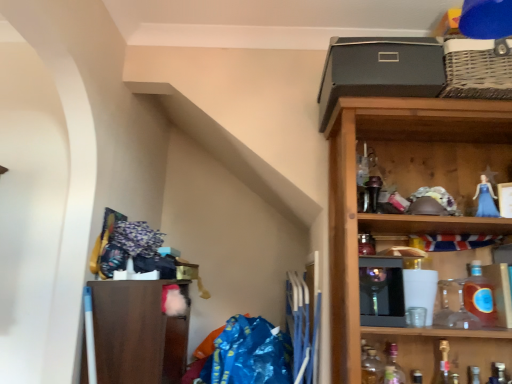
Question: Is translucent amber glass bottle at right, positioned as the 2th bottle in right-to-left order, shorter than translucent glass bottle at lower right, which is counted as the fifth bottle, starting from the right?

Choices:
 (A) no
 (B) yes

Answer: (B)

Question: From the image's perspective, does translucent amber glass bottle at right, positioned as the 2th bottle in right-to-left order, appear higher than translucent glass bottle at lower right, which appears as the 1th bottle when viewed from the left?

Choices:
 (A) yes
 (B) no

Answer: (A)

Question: Is the depth of translucent amber glass bottle at right, positioned as the 2th bottle in right-to-left order, less than that of translucent glass bottle at lower right, which is counted as the fifth bottle, starting from the right?

Choices:
 (A) no
 (B) yes

Answer: (A)

Question: Are translucent amber glass bottle at right, positioned as the 2th bottle in right-to-left order, and translucent glass bottle at lower right, which appears as the 1th bottle when viewed from the left, far apart?

Choices:
 (A) no
 (B) yes

Answer: (A)

Question: Is translucent glass bottle at lower right, which appears as the 1th bottle when viewed from the left, located within translucent amber glass bottle at right, positioned as the 2th bottle in right-to-left order?

Choices:
 (A) no
 (B) yes

Answer: (A)

Question: Is wooden shelf at upper right, which ranks as the second shelf in left-to-right order, wider or thinner than translucent glass bottle at lower right, the second bottle viewed from the left?

Choices:
 (A) wide
 (B) thin

Answer: (A)

Question: Relative to translucent glass bottle at lower right, arranged as the fourth bottle when viewed from the right, is wooden shelf at upper right, which ranks as the second shelf in left-to-right order, in front or behind?

Choices:
 (A) front
 (B) behind

Answer: (A)

Question: Visually, is wooden shelf at upper right, which is the 1th shelf from right to left, positioned to the left or to the right of translucent glass bottle at lower right, the second bottle viewed from the left?

Choices:
 (A) right
 (B) left

Answer: (A)

Question: Is wooden shelf at upper right, which ranks as the second shelf in left-to-right order, spatially inside translucent glass bottle at lower right, arranged as the fourth bottle when viewed from the right, or outside of it?

Choices:
 (A) outside
 (B) inside

Answer: (A)

Question: From a real-world perspective, is translucent amber glass bottle at right, the 4th bottle from the left, physically located above or below brown matte cabinet at lower left, positioned as the second shelf in right-to-left order?

Choices:
 (A) above
 (B) below

Answer: (A)

Question: Considering the relative positions of translucent amber glass bottle at right, the 4th bottle from the left, and brown matte cabinet at lower left, positioned as the second shelf in right-to-left order, in the image provided, is translucent amber glass bottle at right, the 4th bottle from the left, to the left or to the right of brown matte cabinet at lower left, positioned as the second shelf in right-to-left order,?

Choices:
 (A) right
 (B) left

Answer: (A)

Question: Do you think translucent amber glass bottle at right, positioned as the 2th bottle in right-to-left order, is within brown matte cabinet at lower left, the 1th shelf viewed from the left, or outside of it?

Choices:
 (A) outside
 (B) inside

Answer: (A)

Question: Is translucent amber glass bottle at right, positioned as the 2th bottle in right-to-left order, taller or shorter than brown matte cabinet at lower left, the 1th shelf viewed from the left?

Choices:
 (A) tall
 (B) short

Answer: (B)

Question: Considering the positions of translucent glass bottle at lower right, which is counted as the fifth bottle, starting from the right, and translucent amber glass bottle at right, the 4th bottle from the left, in the image, is translucent glass bottle at lower right, which is counted as the fifth bottle, starting from the right, taller or shorter than translucent amber glass bottle at right, the 4th bottle from the left,?

Choices:
 (A) tall
 (B) short

Answer: (A)

Question: Is translucent glass bottle at lower right, which is counted as the fifth bottle, starting from the right, in front of or behind translucent amber glass bottle at right, positioned as the 2th bottle in right-to-left order, in the image?

Choices:
 (A) behind
 (B) front

Answer: (B)